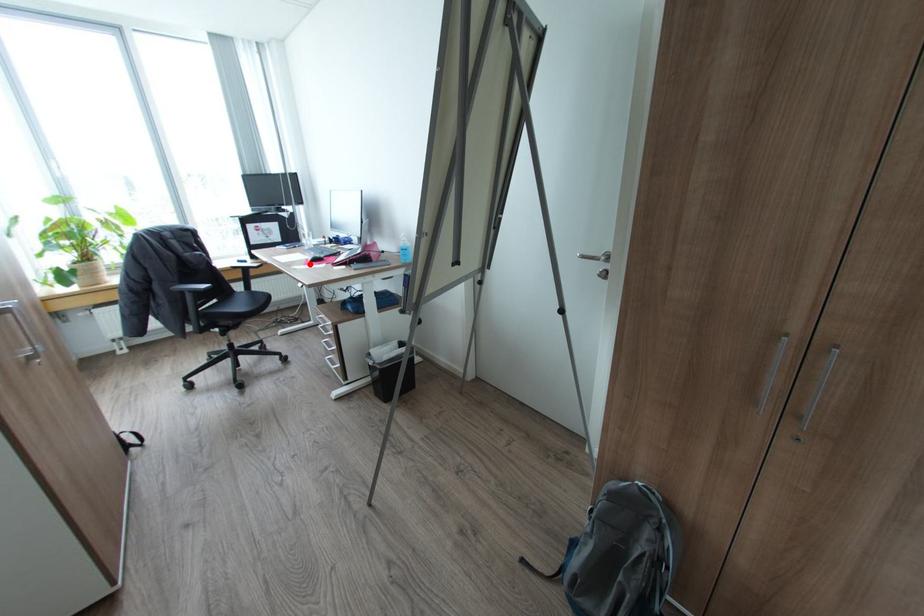
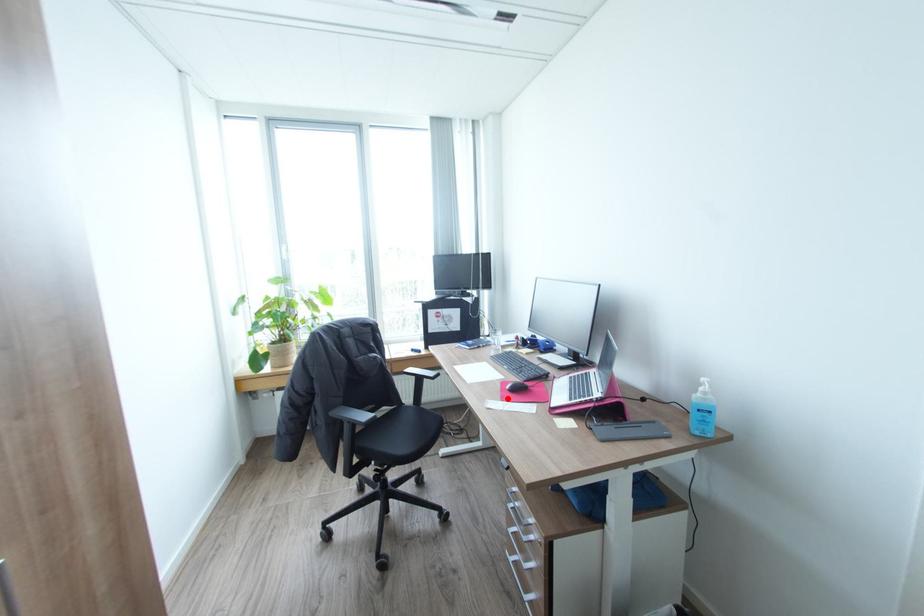
I am providing you with two images of the same scene from different viewpoints. A red point is marked on the first image and another point is marked on the second image. Are the points marked in image1 and image2 representing the same 3D position?

Yes